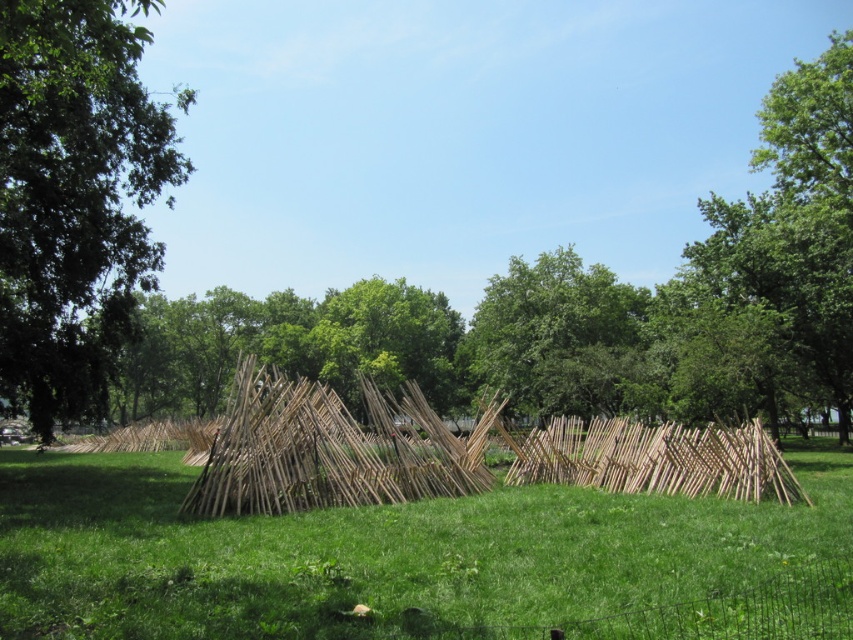
You are standing in the grassy area and want to take a photo of both the green leafy tree at left and the natural wood reed at center. Which object should you focus on first to ensure both are in frame?

The green leafy tree at left is much taller than the natural wood reed at center, so you should focus on the green leafy tree at left first to ensure both are in frame.

You are a landscape architect designing a new garden. You want to place a decorative statue between the natural wood reed at center and the green leafy tree at center. How far apart are these two objects to ensure proper spacing?

The natural wood reed at center and the green leafy tree at center are 11.12 meters apart, so the statue should be placed in between them at a distance that maintains this spacing.

You are planning to set up a picnic blanket in the grassy area between the green leafy tree at left and the green leafy tree at center. Considering their sizes, which tree would provide more shade for your picnic?

The green leafy tree at left is larger in size than the green leafy tree at center, so it would provide more shade for the picnic.